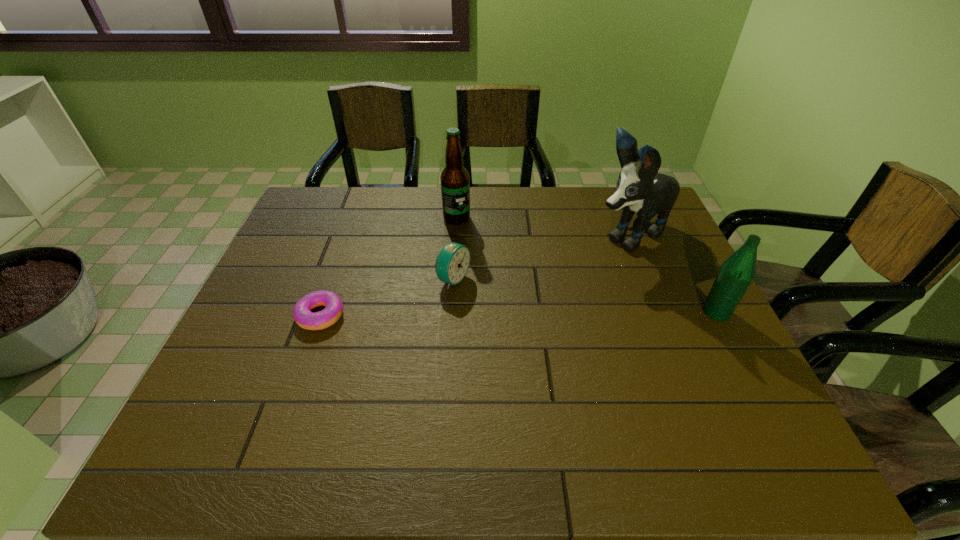
Locate an element on the screen. the second closest object to the leftmost object is located at coordinates (455, 184).

The height and width of the screenshot is (540, 960). What are the coordinates of `vacant space that satisfies the following two spatial constraints: 1. on the front side of the fourth tallest object; 2. on the right side of the second tallest object` in the screenshot? It's located at (452, 280).

Where is `free space that satisfies the following two spatial constraints: 1. on the back side of the puppy; 2. on the left side of the doughnut`? free space that satisfies the following two spatial constraints: 1. on the back side of the puppy; 2. on the left side of the doughnut is located at coordinates (348, 235).